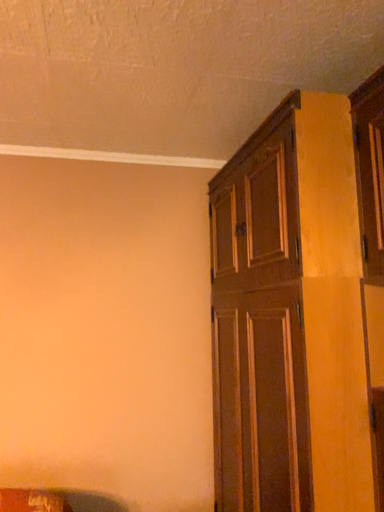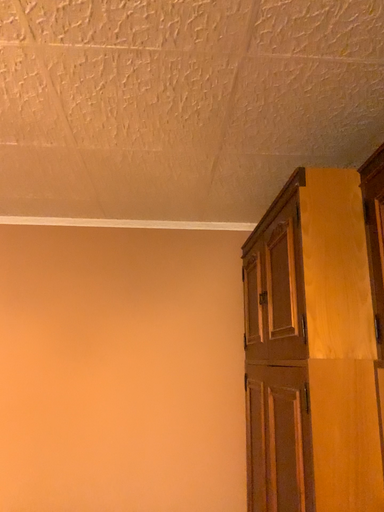
Question: Which way did the camera rotate in the video?

Choices:
 (A) rotated downward
 (B) rotated upward

Answer: (B)